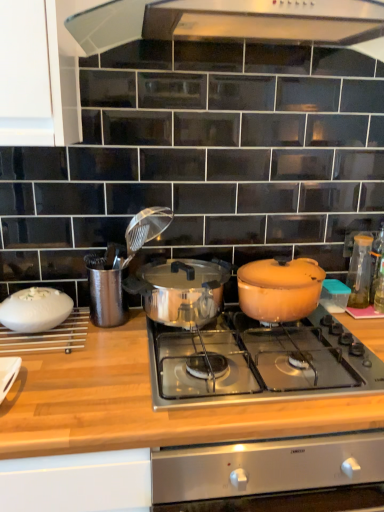
The width and height of the screenshot is (384, 512). Describe the element at coordinates (376, 261) in the screenshot. I see `transparent glass bottle at right` at that location.

The width and height of the screenshot is (384, 512). What do you see at coordinates (279, 289) in the screenshot? I see `matte orange pot at center right, which is the 1th pot/pan from right to left` at bounding box center [279, 289].

Find the location of a particular element. The width and height of the screenshot is (384, 512). matte orange pot at center right, which is the 1th pot/pan from right to left is located at coordinates (279, 289).

This screenshot has width=384, height=512. What do you see at coordinates (71, 476) in the screenshot? I see `wooden at center` at bounding box center [71, 476].

The image size is (384, 512). I want to click on transparent glass bottle at right, which is the second kitchen appliance from front to back, so click(360, 271).

Is wooden at center closer to the viewer compared to transparent glass bottle at right, which is the second kitchen appliance from front to back?

Yes, wooden at center is in front of transparent glass bottle at right, which is the second kitchen appliance from front to back.

Between wooden at center and transparent glass bottle at right, the 1th kitchen appliance positioned from the right, which one has larger size?

wooden at center.

Is wooden at center situated inside transparent glass bottle at right, which is the second kitchen appliance in left-to-right order, or outside?

wooden at center exists outside the volume of transparent glass bottle at right, which is the second kitchen appliance in left-to-right order.

Looking at this image, is wooden at center oriented towards transparent glass bottle at right, which is the second kitchen appliance from front to back?

No.

Considering the positions of objects transparent glass bottle at right and matte orange pot at center right, which is the 1th pot/pan from right to left, in the image provided, who is more to the left, transparent glass bottle at right or matte orange pot at center right, which is the 1th pot/pan from right to left,?

From the viewer's perspective, matte orange pot at center right, which is the 1th pot/pan from right to left, appears more on the left side.

Does transparent glass bottle at right turn towards matte orange pot at center right, which is the 1th pot/pan from right to left?

No, transparent glass bottle at right is not turned towards matte orange pot at center right, which is the 1th pot/pan from right to left.

From the image's perspective, which pot/pan is the 1st one below the transparent glass bottle at right? Please provide its 2D coordinates.

[(279, 289)]

Looking at this image, would you say shiny stainless steel cooktop at center is outside matte orange pot at center right, which appears as the second pot/pan when viewed from the left?

That's correct, shiny stainless steel cooktop at center is outside of matte orange pot at center right, which appears as the second pot/pan when viewed from the left.

Can you tell me how much shiny stainless steel cooktop at center and matte orange pot at center right, which is the 1th pot/pan from right to left, differ in facing direction?

The facing directions of shiny stainless steel cooktop at center and matte orange pot at center right, which is the 1th pot/pan from right to left, are 4.02 degrees apart.

From the image's perspective, which one is positioned lower, shiny stainless steel cooktop at center or matte orange pot at center right, which is the 1th pot/pan from right to left?

shiny stainless steel cooktop at center.

This screenshot has height=512, width=384. Identify the location of gas stove in front of the matte orange pot at center right, which appears as the second pot/pan when viewed from the left. (258, 362).

Which object is thinner, transparent glass bottle at right or wooden at center?

With smaller width is transparent glass bottle at right.

Considering the relative sizes of transparent glass bottle at right and wooden at center in the image provided, is transparent glass bottle at right bigger than wooden at center?

No.

From the image's perspective, is transparent glass bottle at right beneath wooden at center?

Actually, transparent glass bottle at right appears above wooden at center in the image.

From the picture: What's the angular difference between transparent glass bottle at right and wooden at center's facing directions?

The angular difference between transparent glass bottle at right and wooden at center is 0.685 degrees.

Based on the photo, is white matte bowl at left, the 2th kitchen appliance from the right, positioned far away from wooden at center?

That's not correct — white matte bowl at left, the 2th kitchen appliance from the right, is a little close to wooden at center.

Would you say white matte bowl at left, the first kitchen appliance from the front, is to the left or to the right of wooden at center in the picture?

In the image, white matte bowl at left, the first kitchen appliance from the front, appears on the left side of wooden at center.

Is wooden at center located within white matte bowl at left, the first kitchen appliance from the front?

Actually, wooden at center is outside white matte bowl at left, the first kitchen appliance from the front.

From the image's perspective, is white matte bowl at left, the first kitchen appliance from the front, below wooden at center?

Actually, white matte bowl at left, the first kitchen appliance from the front, appears above wooden at center in the image.

Is transparent glass bottle at right, which is the second kitchen appliance from front to back, to the left of matte orange pot at center right, which is the 1th pot/pan from right to left, from the viewer's perspective?

Incorrect, transparent glass bottle at right, which is the second kitchen appliance from front to back, is not on the left side of matte orange pot at center right, which is the 1th pot/pan from right to left.

Is transparent glass bottle at right, which is the second kitchen appliance in left-to-right order, oriented away from matte orange pot at center right, which appears as the second pot/pan when viewed from the left?

transparent glass bottle at right, which is the second kitchen appliance in left-to-right order, does not have its back to matte orange pot at center right, which appears as the second pot/pan when viewed from the left.

Is transparent glass bottle at right, the 1th kitchen appliance positioned from the right, not near matte orange pot at center right, which appears as the second pot/pan when viewed from the left?

No, transparent glass bottle at right, the 1th kitchen appliance positioned from the right, is not far from matte orange pot at center right, which appears as the second pot/pan when viewed from the left.

Considering the sizes of objects transparent glass bottle at right, which is the second kitchen appliance in left-to-right order, and matte orange pot at center right, which appears as the second pot/pan when viewed from the left, in the image provided, who is thinner, transparent glass bottle at right, which is the second kitchen appliance in left-to-right order, or matte orange pot at center right, which appears as the second pot/pan when viewed from the left,?

transparent glass bottle at right, which is the second kitchen appliance in left-to-right order, is thinner.

From a real-world perspective, is matte orange pot at center right, which appears as the second pot/pan when viewed from the left, over transparent glass bottle at right, which is the second kitchen appliance from front to back?

Incorrect, from a real-world perspective, matte orange pot at center right, which appears as the second pot/pan when viewed from the left, is lower than transparent glass bottle at right, which is the second kitchen appliance from front to back.

Considering the relative sizes of matte orange pot at center right, which appears as the second pot/pan when viewed from the left, and transparent glass bottle at right, which is the second kitchen appliance from front to back, in the image provided, is matte orange pot at center right, which appears as the second pot/pan when viewed from the left, smaller than transparent glass bottle at right, which is the second kitchen appliance from front to back,?

No.

Would you say matte orange pot at center right, which is the 1th pot/pan from right to left, contains transparent glass bottle at right, which is the second kitchen appliance in left-to-right order?

No, transparent glass bottle at right, which is the second kitchen appliance in left-to-right order, is not surrounded by matte orange pot at center right, which is the 1th pot/pan from right to left.

Are matte orange pot at center right, which appears as the second pot/pan when viewed from the left, and transparent glass bottle at right, which is the second kitchen appliance from front to back, far apart?

No, matte orange pot at center right, which appears as the second pot/pan when viewed from the left, is not far away from transparent glass bottle at right, which is the second kitchen appliance from front to back.

There is a wooden at center. At what (x,y) coordinates should I click in order to perform the action: click on the 2nd kitchen appliance above it (from the image's perspective). Please return your answer as a coordinate pair (x, y). This screenshot has height=512, width=384. Looking at the image, I should click on (360, 271).

Locate an element on the screen. The width and height of the screenshot is (384, 512). bottle lying on the right of matte orange pot at center right, which is the 1th pot/pan from right to left is located at coordinates (376, 261).

Which object lies further to the anchor point shiny stainless steel cooktop at center, polished stainless steel pot at center, arranged as the 2th pot/pan when viewed from the right, or white matte bowl at left, the first kitchen appliance from the front?

white matte bowl at left, the first kitchen appliance from the front, is further to shiny stainless steel cooktop at center.

From the image, which object appears to be farther from polished stainless steel pot at center, arranged as the 2th pot/pan when viewed from the right, transparent glass bottle at right or transparent glass bottle at right, which is the second kitchen appliance from front to back?

transparent glass bottle at right lies further to polished stainless steel pot at center, arranged as the 2th pot/pan when viewed from the right, than the other object.

Estimate the real-world distances between objects in this image. Which object is closer to wooden at center, transparent glass bottle at right, the 1th kitchen appliance positioned from the right, or shiny stainless steel cooktop at center?

Among the two, shiny stainless steel cooktop at center is located nearer to wooden at center.

Considering their positions, is white matte bowl at left, acting as the first kitchen appliance starting from the left, positioned closer to transparent glass bottle at right than polished stainless steel pot at center, which is the 1th pot/pan from left to right?

polished stainless steel pot at center, which is the 1th pot/pan from left to right.

Estimate the real-world distances between objects in this image. Which object is further from wooden at center, polished stainless steel pot at center, arranged as the 2th pot/pan when viewed from the right, or transparent glass bottle at right, the 1th kitchen appliance positioned from the right?

transparent glass bottle at right, the 1th kitchen appliance positioned from the right, is positioned further to the anchor wooden at center.

Which object lies further to the anchor point transparent glass bottle at right, which is the 1th kitchen appliance from back to front, polished stainless steel pot at center, arranged as the 2th pot/pan when viewed from the right, or wooden at center?

The object further to transparent glass bottle at right, which is the 1th kitchen appliance from back to front, is wooden at center.

Considering their positions, is transparent glass bottle at right positioned further to transparent glass bottle at right, which is the 1th kitchen appliance from back to front, than shiny stainless steel cooktop at center?

shiny stainless steel cooktop at center is positioned further to the anchor transparent glass bottle at right, which is the 1th kitchen appliance from back to front.

When comparing their distances from polished stainless steel pot at center, which is the 1th pot/pan from left to right, does matte orange pot at center right, which is the 1th pot/pan from right to left, or white matte bowl at left, the 2th kitchen appliance from the right, seem closer?

The object closer to polished stainless steel pot at center, which is the 1th pot/pan from left to right, is matte orange pot at center right, which is the 1th pot/pan from right to left.

Identify the location of gas stove situated between white matte bowl at left, the 2th kitchen appliance from the right, and matte orange pot at center right, which is the 1th pot/pan from right to left, from left to right. The width and height of the screenshot is (384, 512). (258, 362).

The height and width of the screenshot is (512, 384). Identify the location of gas stove between white matte bowl at left, the 2th kitchen appliance from the right, and transparent glass bottle at right. tap(258, 362).

Where is `pot/pan situated between polished stainless steel pot at center, which is the 1th pot/pan from left to right, and transparent glass bottle at right, which is the second kitchen appliance in left-to-right order, from left to right`? This screenshot has height=512, width=384. pot/pan situated between polished stainless steel pot at center, which is the 1th pot/pan from left to right, and transparent glass bottle at right, which is the second kitchen appliance in left-to-right order, from left to right is located at coordinates (279, 289).

Find the location of `gas stove situated between polished stainless steel pot at center, which is the 1th pot/pan from left to right, and transparent glass bottle at right, which is the second kitchen appliance from front to back, from left to right`. gas stove situated between polished stainless steel pot at center, which is the 1th pot/pan from left to right, and transparent glass bottle at right, which is the second kitchen appliance from front to back, from left to right is located at coordinates (258, 362).